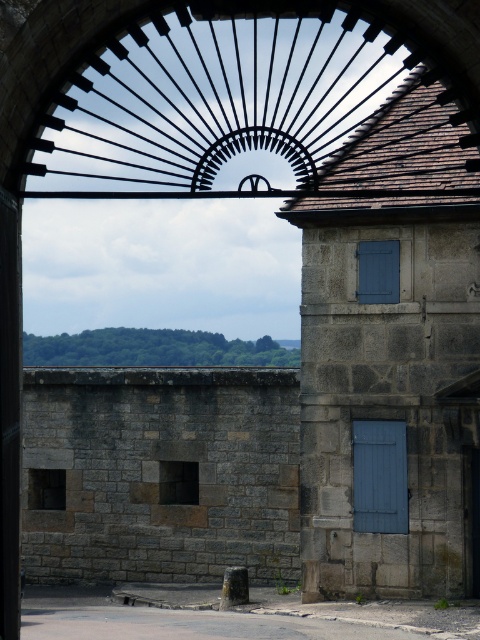
What are the coordinates of `black iron gate at upper center` in the screenshot? It's located at (252, 100).

Which is more to the left, black iron gate at upper center or wooden door at right?

Positioned to the left is black iron gate at upper center.

Locate an element on the screen. The width and height of the screenshot is (480, 640). black iron gate at upper center is located at coordinates (252, 100).

Find the location of a particular element. This screenshot has height=640, width=480. black iron gate at upper center is located at coordinates (252, 100).

Does black iron gate at upper center have a smaller size compared to blue wooden door at center?

No.

Measure the distance between black iron gate at upper center and blue wooden door at center.

They are 17.77 meters apart.

Between point (208, 148) and point (372, 440), which one is positioned behind?

The point (372, 440) is behind.

I want to click on black iron gate at upper center, so click(x=252, y=100).

Which of these two, blue wooden door at center or wooden door at right, stands taller?

wooden door at right

Which is below, blue wooden door at center or wooden door at right?

wooden door at right is lower down.

Image resolution: width=480 pixels, height=640 pixels. Describe the element at coordinates (380, 476) in the screenshot. I see `blue wooden door at center` at that location.

Identify the location of blue wooden door at center. This screenshot has width=480, height=640. (380, 476).